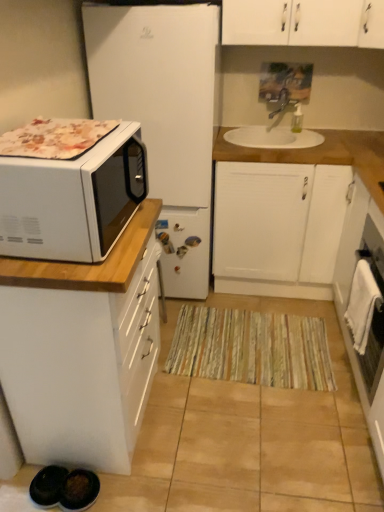
You are a GUI agent. You are given a task and a screenshot of the screen. Output one action in this format:
    pyautogui.click(x=<x>, y=<y>)
    Task: Click on the blank space situated above striped fabric doormat at center (from a real-world perspective)
    Image resolution: width=384 pixels, height=512 pixels.
    Given the screenshot: What is the action you would take?
    pyautogui.click(x=255, y=339)